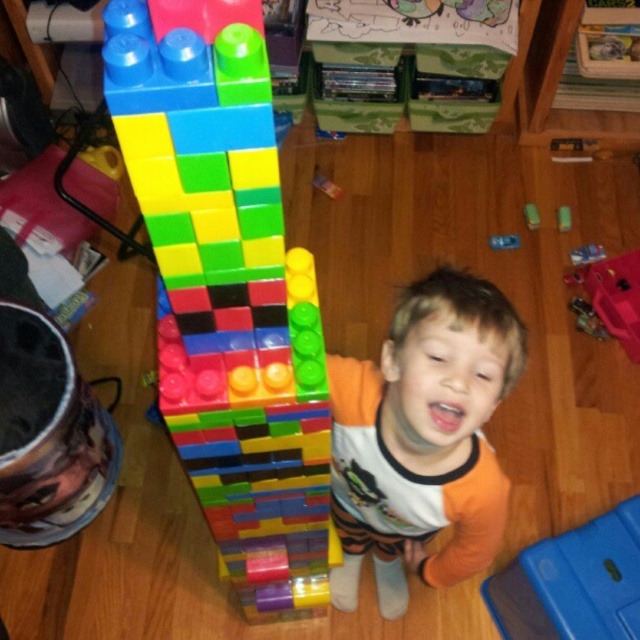
You are a parent trying to hand your child a toy. You have two items in your hand, the metallic blue remote at center and the green rubber eraser at center. Which item is wider so you can choose the appropriate one to give to the child?

The metallic blue remote at center is wider than the green rubber eraser at center according to the description, so you should choose the metallic blue remote at center to give to the child.

You are a parent holding a metallic blue remote at center. You want to hand it to your child who is standing next to the tower. Can you reach them without moving from your current position?

The metallic blue remote at center is 1.94 meters from the camera, so if the child is standing next to the tower, the distance between you and the child may be greater than 1.94 meters. Therefore, you might not be able to reach them without moving.